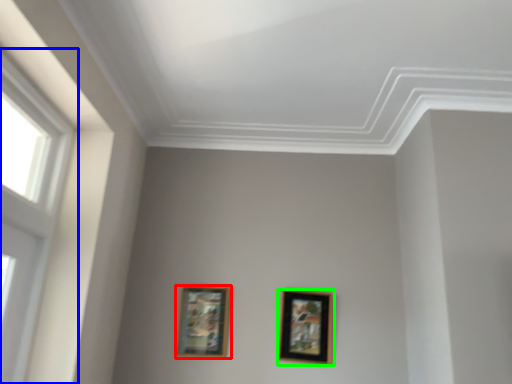
Question: Based on their relative distances, which object is nearer to picture frame (highlighted by a red box)? Choose from window (highlighted by a blue box) and picture frame (highlighted by a green box).

Choices:
 (A) window
 (B) picture frame

Answer: (B)